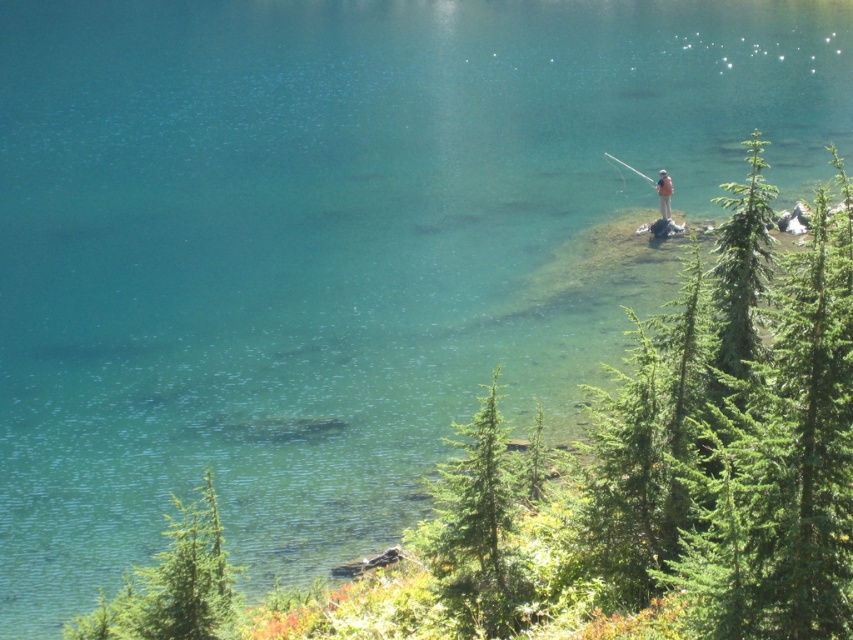
Who is more distant from viewer, (135, 572) or (665, 216)?

The point (665, 216) is more distant.

Can you confirm if green matte tree at lower left is bigger than camouflage fabric person at center?

Correct, green matte tree at lower left is larger in size than camouflage fabric person at center.

Between point (166, 608) and point (662, 192), which one is positioned in front?

Point (166, 608)

The image size is (853, 640). I want to click on green matte tree at lower left, so click(171, 584).

How much distance is there between green matte tree at lower center and camouflage fabric person at center?

green matte tree at lower center and camouflage fabric person at center are 109.52 feet apart from each other.

Identify the location of green matte tree at lower center. (476, 531).

From the picture: Can you confirm if green matte tree at lower center is smaller than green matte tree at lower left?

Yes, green matte tree at lower center is smaller than green matte tree at lower left.

Is green matte tree at lower center to the right of green matte tree at lower left from the viewer's perspective?

Correct, you'll find green matte tree at lower center to the right of green matte tree at lower left.

Where is `green matte tree at lower center`? green matte tree at lower center is located at coordinates (476, 531).